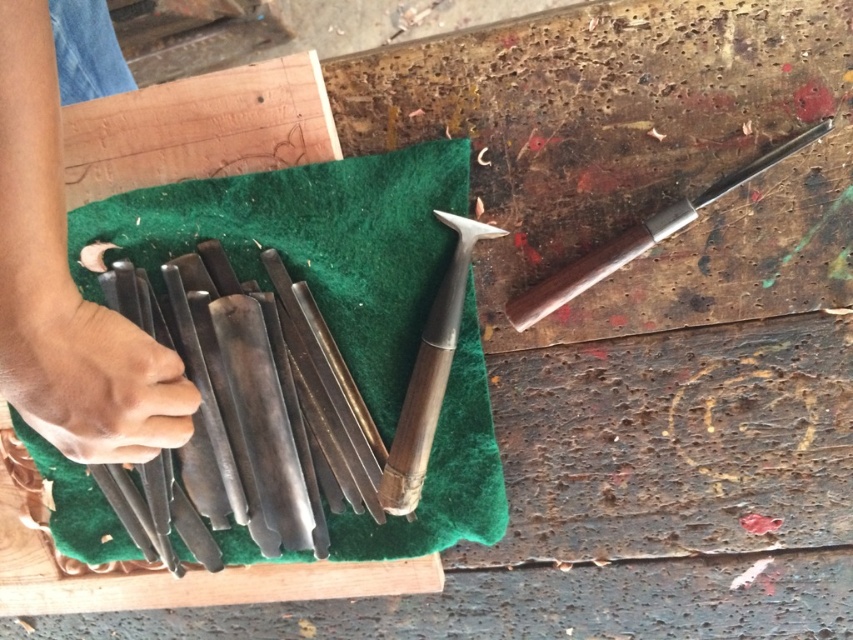
Describe the element at coordinates (254, 401) in the screenshot. I see `polished metal knife at center` at that location.

Is point (99, 280) closer to camera compared to point (160, 356)?

No, (99, 280) is further to viewer.

The height and width of the screenshot is (640, 853). I want to click on polished metal knife at center, so click(x=254, y=401).

Can you confirm if dark skin hand at lower left is bigger than polished metal knife at center?

Yes.

The image size is (853, 640). In order to click on dark skin hand at lower left in this screenshot , I will do `click(67, 256)`.

Does smooth wood at upper left have a lesser height compared to dark brown wood at left?

Indeed, smooth wood at upper left has a lesser height compared to dark brown wood at left.

How far apart are smooth wood at upper left and dark brown wood at left?

smooth wood at upper left is 7.59 inches away from dark brown wood at left.

Between point (77, 182) and point (157, 378), which one is positioned behind?

Point (77, 182)

Identify the location of smooth wood at upper left. (199, 129).